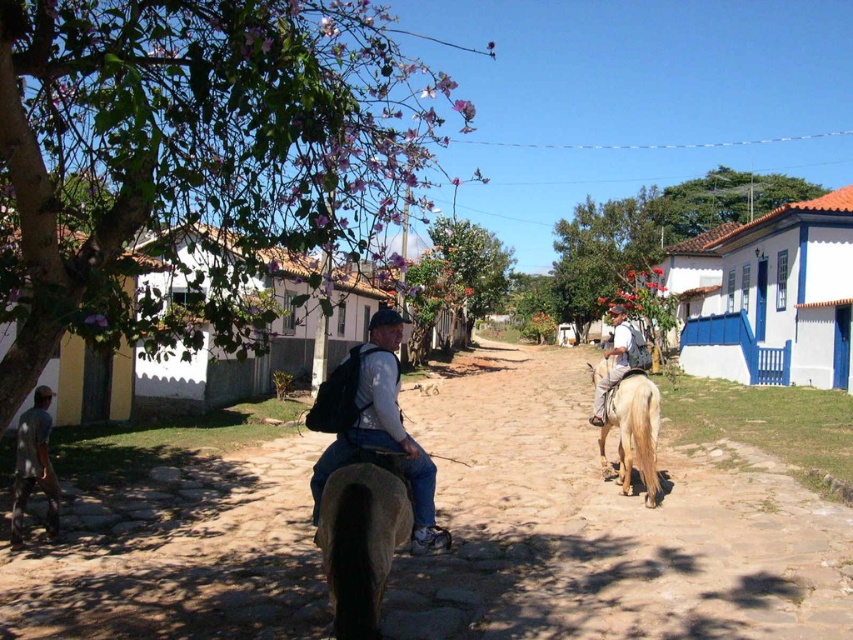
Between brown matte horse at center and golden blonde horse at right, which one is positioned higher?

brown matte horse at center is higher up.

Between point (369, 516) and point (636, 387), which one is positioned behind?

The point (636, 387) is behind.

Who is more forward, (350, 634) or (639, 372)?

Point (350, 634) is in front.

Where is `brown matte horse at center`? brown matte horse at center is located at coordinates (361, 540).

Is golden blonde horse at right shorter than gray fabric shirt at lower left?

Yes, golden blonde horse at right is shorter than gray fabric shirt at lower left.

This screenshot has height=640, width=853. Describe the element at coordinates (633, 433) in the screenshot. I see `golden blonde horse at right` at that location.

Identify the location of golden blonde horse at right. This screenshot has width=853, height=640. (633, 433).

Locate an element on the screen. The width and height of the screenshot is (853, 640). golden blonde horse at right is located at coordinates (633, 433).

Which is in front, point (329, 412) or point (22, 458)?

Point (329, 412) is in front.

Can you confirm if matte black backpack at center is positioned below gray fabric shirt at lower left?

No.

Where is `matte black backpack at center`? matte black backpack at center is located at coordinates (374, 422).